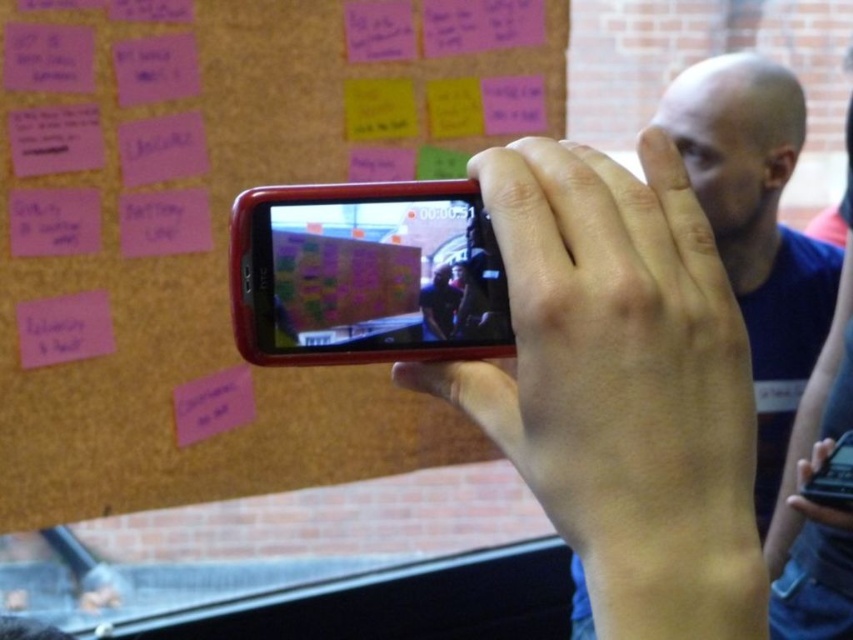
Question: Which point is farther from the camera taking this photo?

Choices:
 (A) (846, 506)
 (B) (287, 173)
 (C) (548, 145)

Answer: (B)

Question: From the image, what is the correct spatial relationship of pink matte bulletin board at upper left in relation to matte black phone at center?

Choices:
 (A) above
 (B) below

Answer: (A)

Question: Which is farther from the pink matte bulletin board at upper left?

Choices:
 (A) matte black phone at center
 (B) black glossy smartphone at center
 (C) matte plastic hand at center
 (D) bald head at center

Answer: (C)

Question: Does bald head at center appear on the left side of black glossy smartphone at center?

Choices:
 (A) no
 (B) yes

Answer: (A)

Question: Estimate the real-world distances between objects in this image. Which object is closer to the matte black phone at center?

Choices:
 (A) matte plastic hand at center
 (B) black glossy smartphone at center

Answer: (A)

Question: Does pink matte bulletin board at upper left appear on the right side of matte plastic hand at center?

Choices:
 (A) yes
 (B) no

Answer: (B)